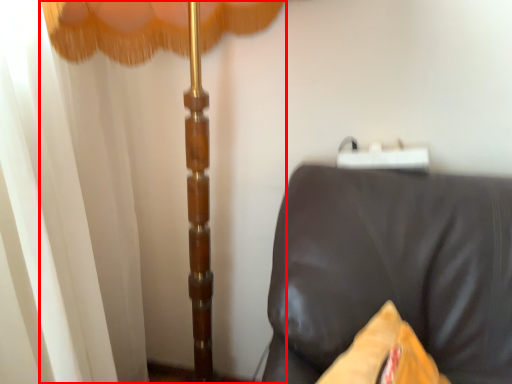
Question: Considering the relative positions of curtain (annotated by the red box) and furniture in the image provided, where is curtain (annotated by the red box) located with respect to the staircase?

Choices:
 (A) left
 (B) right

Answer: (A)